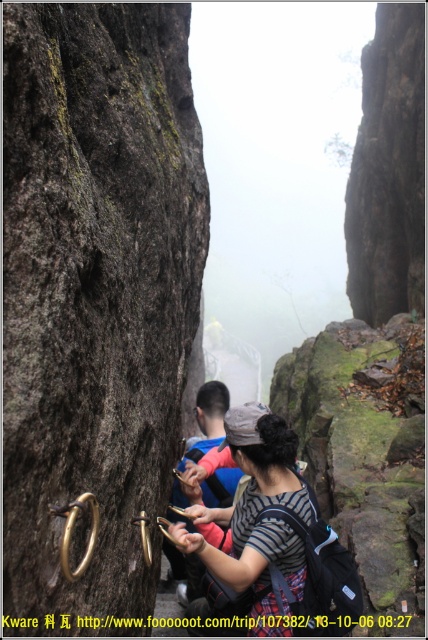
Question: Is gold metallic rings at lower left to the right of blue fabric jacket at center from the viewer's perspective?

Choices:
 (A) yes
 (B) no

Answer: (B)

Question: Does gold metallic rings at lower left appear over striped fabric shirt at center?

Choices:
 (A) yes
 (B) no

Answer: (A)

Question: Which of the following is the farthest from the observer?

Choices:
 (A) [x=279, y=429]
 (B) [x=85, y=365]
 (C) [x=222, y=397]

Answer: (C)

Question: Which point is closer to the camera?

Choices:
 (A) (202, 550)
 (B) (210, 497)
 (C) (148, 509)

Answer: (A)

Question: Does gold metallic rings at lower left have a smaller size compared to blue fabric jacket at center?

Choices:
 (A) yes
 (B) no

Answer: (A)

Question: Which object appears farthest from the camera in this image?

Choices:
 (A) gold metallic rings at lower left
 (B) blue fabric jacket at center

Answer: (A)